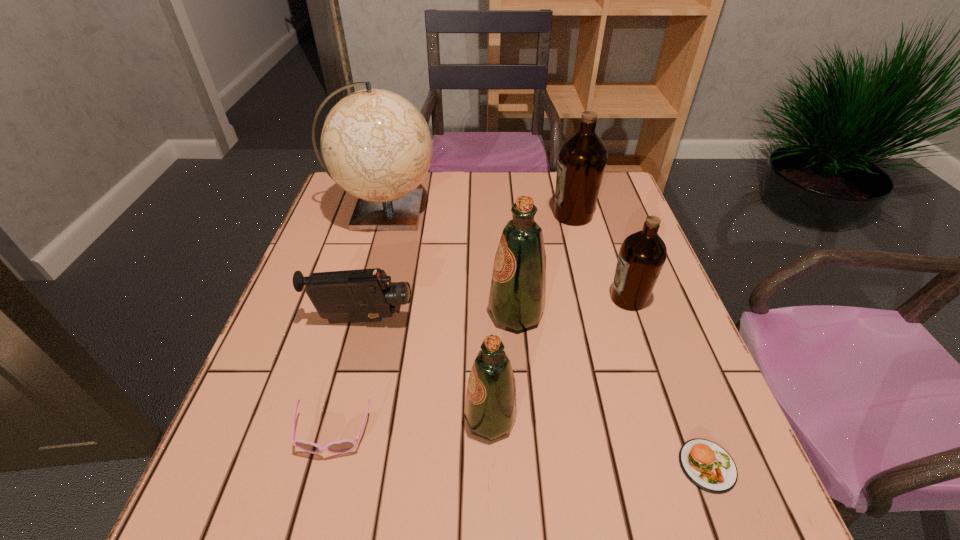
Locate an element on the screen. The height and width of the screenshot is (540, 960). blank space at the left edge is located at coordinates (301, 397).

Where is `vacant space at the right edge`? vacant space at the right edge is located at coordinates (599, 272).

Find the location of a particular element. The height and width of the screenshot is (540, 960). free spot at the far right corner of the desktop is located at coordinates (616, 205).

Locate an element on the screen. This screenshot has height=540, width=960. free area in between the seventh tallest object and the bigger brown olive oil is located at coordinates (453, 325).

The width and height of the screenshot is (960, 540). Find the location of `unoccupied area between the sunglasses and the smaller green olive oil`. unoccupied area between the sunglasses and the smaller green olive oil is located at coordinates (412, 427).

You are a GUI agent. You are given a task and a screenshot of the screen. Output one action in this format:
    pyautogui.click(x=<x>, y=<y>)
    Task: Click on the blank region between the shortest object and the bigger brown olive oil
    The height and width of the screenshot is (540, 960).
    Given the screenshot: What is the action you would take?
    pyautogui.click(x=640, y=340)

Identify the location of vacant space that's between the bigger brown olive oil and the beige globe. (479, 213).

Image resolution: width=960 pixels, height=540 pixels. I want to click on empty space that is in between the bigger brown olive oil and the camcorder, so click(x=468, y=268).

Where is `vacant area between the pink sunglasses and the nearest olive oil`? Image resolution: width=960 pixels, height=540 pixels. vacant area between the pink sunglasses and the nearest olive oil is located at coordinates (412, 427).

Where is `empty location between the patty and the smaller brown olive oil`? This screenshot has width=960, height=540. empty location between the patty and the smaller brown olive oil is located at coordinates (668, 382).